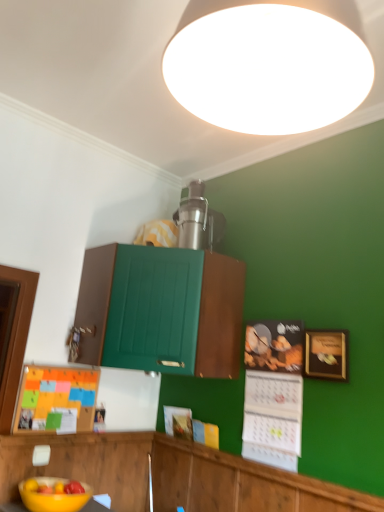
This screenshot has height=512, width=384. Find the location of `free space above wooden cabinet at lower center, placed as the 2th cabinetry when sorted from top to bottom (from a real-world perspective)`. free space above wooden cabinet at lower center, placed as the 2th cabinetry when sorted from top to bottom (from a real-world perspective) is located at coordinates (247, 453).